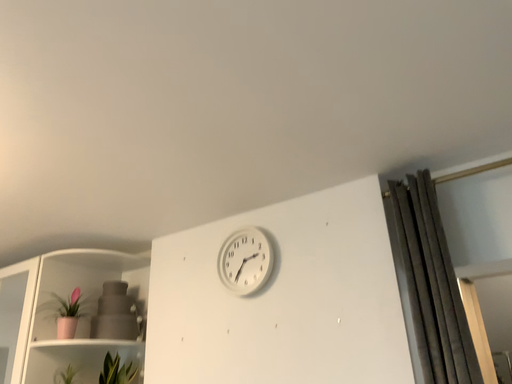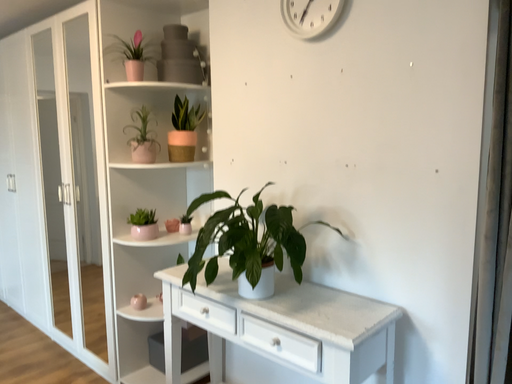
Question: Which way did the camera rotate in the video?

Choices:
 (A) rotated right
 (B) rotated left

Answer: (B)